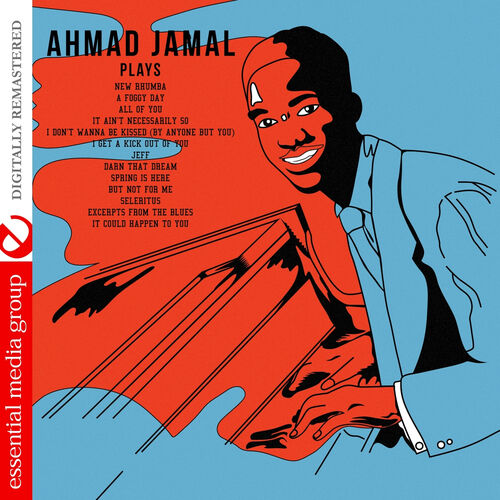
Identify the location of animated piano lid. This screenshot has width=500, height=500. (144, 316), (255, 318).